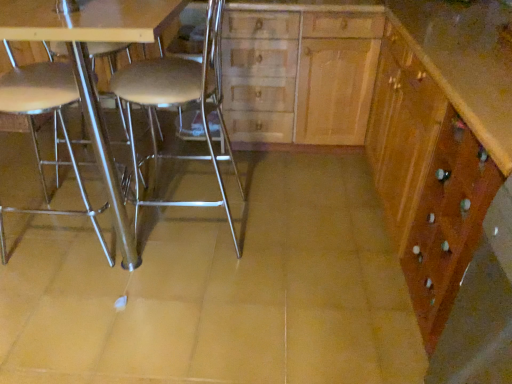
This screenshot has height=384, width=512. I want to click on free point below metallic silver chair at left, arranged as the second chair when viewed from the right (from a real-world perspective), so click(56, 232).